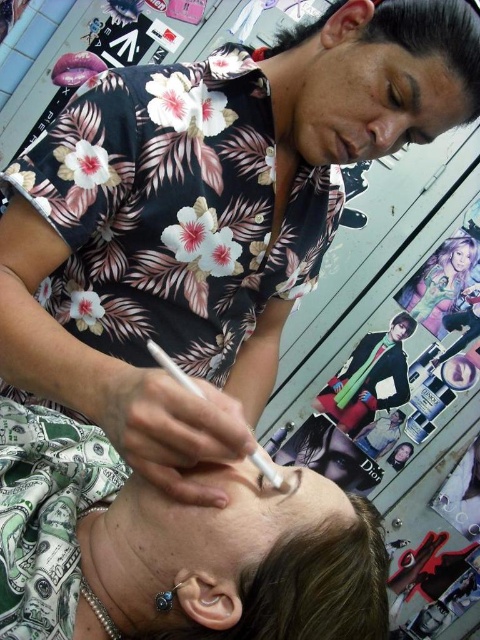
Question: Among these points, which one is nearest to the camera?

Choices:
 (A) (346, 150)
 (B) (282, 484)
 (C) (370, 445)

Answer: (B)

Question: Is green fabric suit at center to the left of matte pink lips at upper left from the viewer's perspective?

Choices:
 (A) yes
 (B) no

Answer: (B)

Question: Which point appears closest to the camera in this image?

Choices:
 (A) (200, 515)
 (B) (371, 368)
 (C) (347, 156)

Answer: (A)

Question: Observing the image, what is the correct spatial positioning of matte black shirt at upper center in reference to matte black mouth at upper center?

Choices:
 (A) right
 (B) left

Answer: (A)

Question: Which object is closer to the camera taking this photo?

Choices:
 (A) matte green dollar bill at lower left
 (B) matte pink lips at upper left
 (C) matte black shirt at upper center
 (D) matte black mouth at upper center

Answer: (A)

Question: Is matte plastic poster at upper right thinner than matte black mouth at upper center?

Choices:
 (A) yes
 (B) no

Answer: (B)